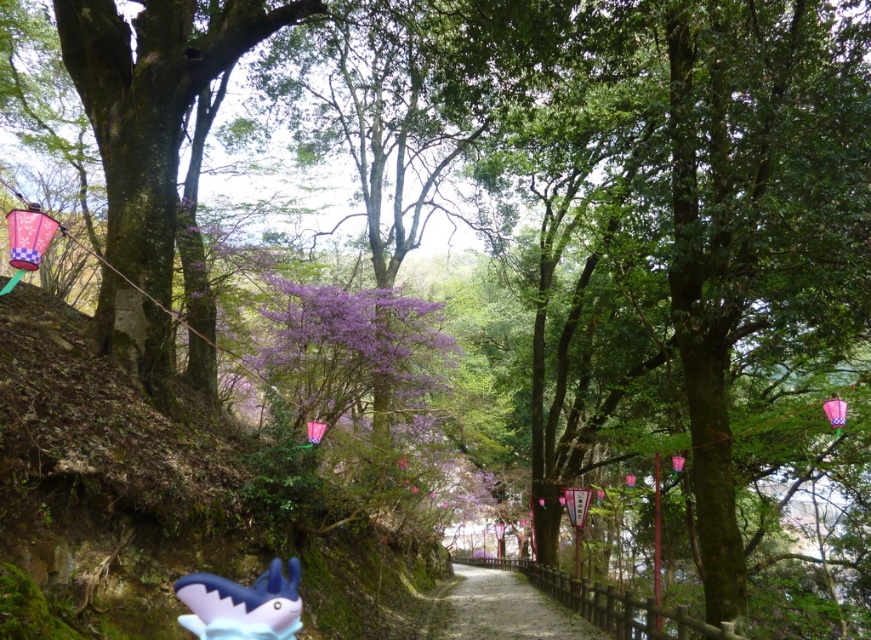
Question: Considering the relative positions of gravel path at center and matte blue plastic shark at lower left in the image provided, where is gravel path at center located with respect to matte blue plastic shark at lower left?

Choices:
 (A) right
 (B) left

Answer: (A)

Question: Can you confirm if gravel path at center is bigger than matte blue plastic shark at lower left?

Choices:
 (A) no
 (B) yes

Answer: (B)

Question: Among these objects, which one is nearest to the camera?

Choices:
 (A) gravel path at center
 (B) matte blue plastic shark at lower left

Answer: (B)

Question: From the image, what is the correct spatial relationship of gravel path at center in relation to matte blue plastic shark at lower left?

Choices:
 (A) above
 (B) below

Answer: (B)